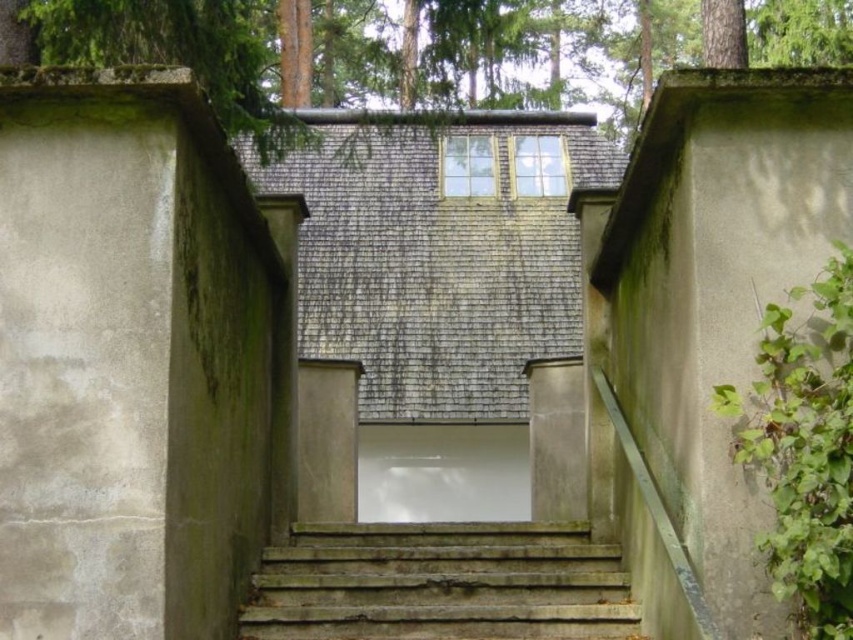
You are standing at the base of the path leading to the modernist house. You see the green textured tree at upper center and the rusty concrete stairs at center. Which object is closer to you?

The green textured tree at upper center is closer to the viewer than the rusty concrete stairs at center.

You are a painter standing at the base of the rusty concrete stairs at center, planning to paint the green textured tree at upper center. To ensure you have a clear view of the tree without obstruction, which direction should you move relative to the stairs?

You should move to the side of the rusty concrete stairs at center so that the green textured tree at upper center is visible without obstruction from the stairs.